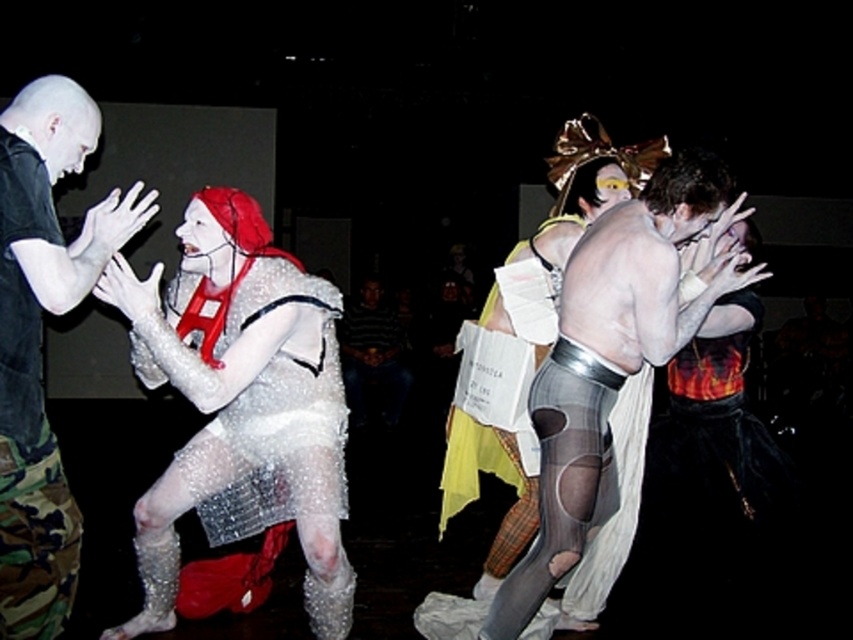
Question: Estimate the real-world distances between objects in this image. Which object is farther from the camo fabric pants at left?

Choices:
 (A) matte silver body at center
 (B) sparkly silver dress at center

Answer: (A)

Question: Does matte silver body at center have a larger size compared to camo fabric pants at left?

Choices:
 (A) yes
 (B) no

Answer: (A)

Question: Which is farther from the matte silver body at center?

Choices:
 (A) camo fabric pants at left
 (B) sparkly silver dress at center
 (C) white matte paint at left

Answer: (A)

Question: In this image, where is sparkly silver dress at center located relative to white matte paint at left?

Choices:
 (A) above
 (B) below

Answer: (B)

Question: Is sparkly silver dress at center below white matte paint at left?

Choices:
 (A) no
 (B) yes

Answer: (B)

Question: Which object appears farthest from the camera in this image?

Choices:
 (A) camo fabric pants at left
 (B) matte silver body at center
 (C) white matte paint at left
 (D) sparkly silver dress at center

Answer: (B)